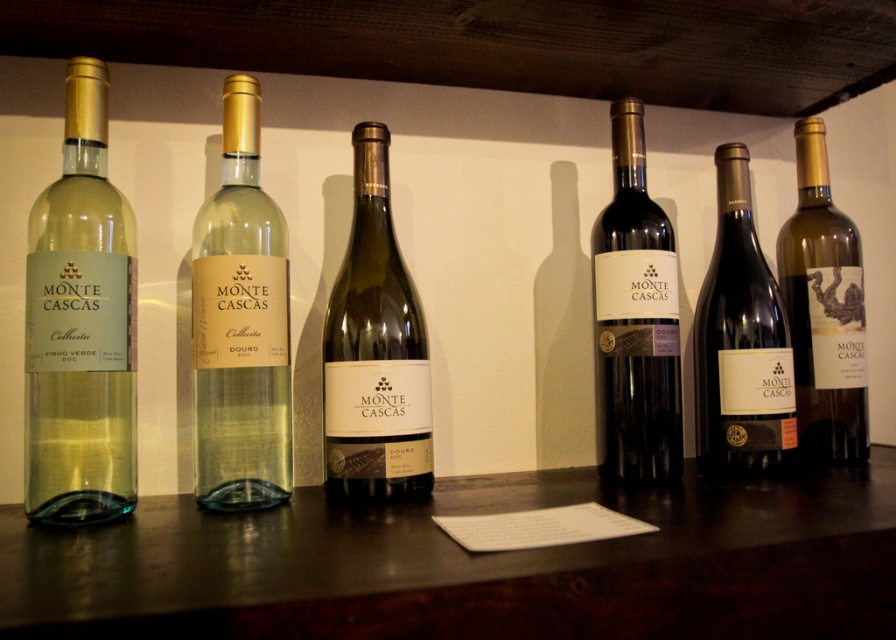
Does point (406, 344) lie behind point (842, 358)?

No.

Does green glass bottle at center appear on the right side of matte gold wine bottle at right?

Incorrect, green glass bottle at center is not on the right side of matte gold wine bottle at right.

Is point (399, 458) more distant than point (808, 195)?

No, it is not.

Identify the location of green glass bottle at center. (x=375, y=348).

In the scene shown: Is dark wood table at center to the left of matte brown bottle at center from the viewer's perspective?

Indeed, dark wood table at center is positioned on the left side of matte brown bottle at center.

Who is shorter, dark wood table at center or matte brown bottle at center?

dark wood table at center

Who is more forward, (x=698, y=499) or (x=765, y=424)?

Point (x=698, y=499) is in front.

The width and height of the screenshot is (896, 640). Find the location of `dark wood table at center`. dark wood table at center is located at coordinates (474, 564).

Between matte glass wine bottle at left and matte glass wine bottle at center, which one is positioned lower?

matte glass wine bottle at center is below.

Can you confirm if matte glass wine bottle at left is positioned to the right of matte glass wine bottle at center?

Incorrect, matte glass wine bottle at left is not on the right side of matte glass wine bottle at center.

Who is more distant from viewer, (93, 465) or (202, 390)?

The point (202, 390) is behind.

The height and width of the screenshot is (640, 896). Find the location of `matte glass wine bottle at left`. matte glass wine bottle at left is located at coordinates (80, 324).